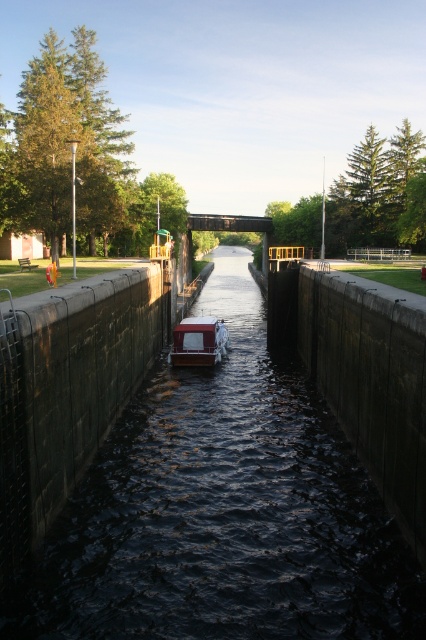
Who is positioned more to the left, dark concrete waterway at center or white glossy boat at center?

white glossy boat at center

How far apart are dark concrete waterway at center and white glossy boat at center?

dark concrete waterway at center and white glossy boat at center are 9.53 feet apart from each other.

The width and height of the screenshot is (426, 640). I want to click on dark concrete waterway at center, so click(222, 509).